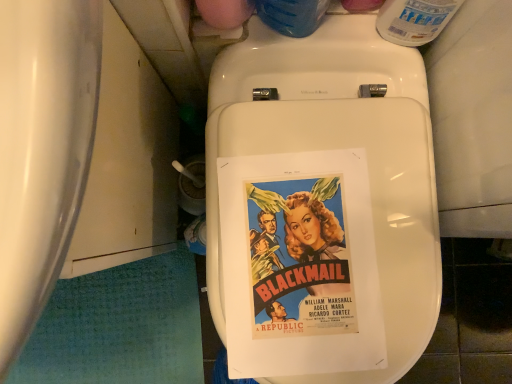
Consider the image. Measure the distance between point (389, 28) and camera.

They are 23.86 inches apart.

Describe the element at coordinates (414, 20) in the screenshot. This screenshot has height=384, width=512. I see `white plastic bottle at upper right` at that location.

What is the approximate width of white plastic bottle at upper right?

Answer: white plastic bottle at upper right is 2.48 inches in width.

Identify the location of white plastic bottle at upper right. This screenshot has height=384, width=512. (414, 20).

The height and width of the screenshot is (384, 512). I want to click on white plastic bottle at upper right, so click(x=414, y=20).